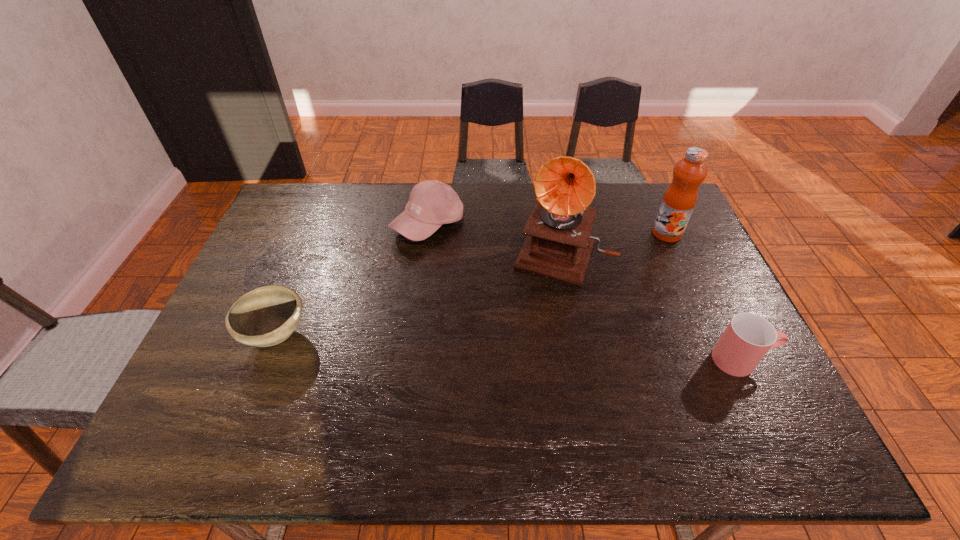
Where is `object that is positioned at the left edge`? object that is positioned at the left edge is located at coordinates (266, 316).

Image resolution: width=960 pixels, height=540 pixels. I want to click on cup that is at the right edge, so click(x=748, y=337).

You are a GUI agent. You are given a task and a screenshot of the screen. Output one action in this format:
    pyautogui.click(x=<x>, y=<y>)
    Task: Click on the fruit juice located in the right edge section of the desktop
    The image size is (960, 540).
    Given the screenshot: What is the action you would take?
    pyautogui.click(x=679, y=200)

You are a GUI agent. You are given a task and a screenshot of the screen. Output one action in this format:
    pyautogui.click(x=<x>, y=<y>)
    Task: Click on the object at the far right corner
    Image resolution: width=960 pixels, height=540 pixels.
    Given the screenshot: What is the action you would take?
    pyautogui.click(x=679, y=200)

Where is `object situated at the near right corner`? The image size is (960, 540). object situated at the near right corner is located at coordinates (748, 337).

At what (x,y) coordinates should I click in order to perform the action: click on vacant region at the far edge. Please return your answer as a coordinate pair (x, y). The height and width of the screenshot is (540, 960). Looking at the image, I should click on (336, 193).

Locate an element on the screen. This screenshot has width=960, height=540. free region at the near edge of the desktop is located at coordinates (544, 398).

The width and height of the screenshot is (960, 540). I want to click on free space at the right edge of the desktop, so 723,372.

At what (x,y) coordinates should I click in order to perform the action: click on blank area at the near left corner. Please return your answer as a coordinate pair (x, y). This screenshot has width=960, height=540. Looking at the image, I should click on (203, 402).

You are a GUI agent. You are given a task and a screenshot of the screen. Output one action in this format:
    pyautogui.click(x=<x>, y=<y>)
    Task: Click on the free space at the far right corner of the desktop
    The width and height of the screenshot is (960, 540).
    Given the screenshot: What is the action you would take?
    pyautogui.click(x=643, y=223)